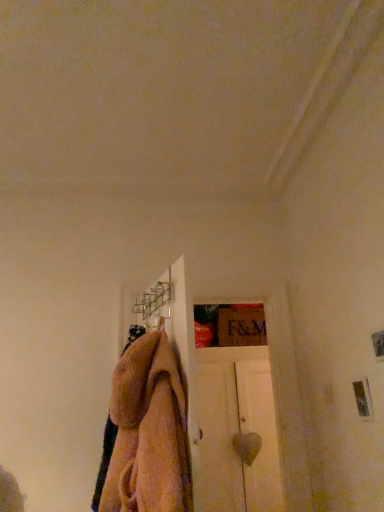
Question: Considering the relative sizes of white matte door at center and beige fuzzy towel at center-left in the image provided, is white matte door at center shorter than beige fuzzy towel at center-left?

Choices:
 (A) no
 (B) yes

Answer: (A)

Question: Is white matte door at center taller than beige fuzzy towel at center-left?

Choices:
 (A) yes
 (B) no

Answer: (A)

Question: Does white matte door at center come in front of beige fuzzy towel at center-left?

Choices:
 (A) yes
 (B) no

Answer: (B)

Question: Could beige fuzzy towel at center-left be considered to be inside white matte door at center?

Choices:
 (A) yes
 (B) no

Answer: (B)

Question: Considering the relative sizes of white matte door at center and beige fuzzy towel at center-left in the image provided, is white matte door at center wider than beige fuzzy towel at center-left?

Choices:
 (A) no
 (B) yes

Answer: (B)

Question: Can you see white matte door at center touching beige fuzzy towel at center-left?

Choices:
 (A) no
 (B) yes

Answer: (A)

Question: Would you consider beige fuzzy towel at center-left to be distant from white matte door at center?

Choices:
 (A) no
 (B) yes

Answer: (B)

Question: Considering the relative sizes of beige fuzzy towel at center-left and white matte door at center in the image provided, is beige fuzzy towel at center-left wider than white matte door at center?

Choices:
 (A) yes
 (B) no

Answer: (B)

Question: Is beige fuzzy towel at center-left positioned in front of white matte door at center?

Choices:
 (A) no
 (B) yes

Answer: (B)

Question: Is beige fuzzy towel at center-left with white matte door at center?

Choices:
 (A) no
 (B) yes

Answer: (A)

Question: From the image's perspective, is beige fuzzy towel at center-left located above white matte door at center?

Choices:
 (A) yes
 (B) no

Answer: (A)

Question: Is beige fuzzy towel at center-left smaller than white matte door at center?

Choices:
 (A) yes
 (B) no

Answer: (A)

Question: From the image's perspective, is white matte door at center above or below beige fuzzy towel at center-left?

Choices:
 (A) below
 (B) above

Answer: (A)